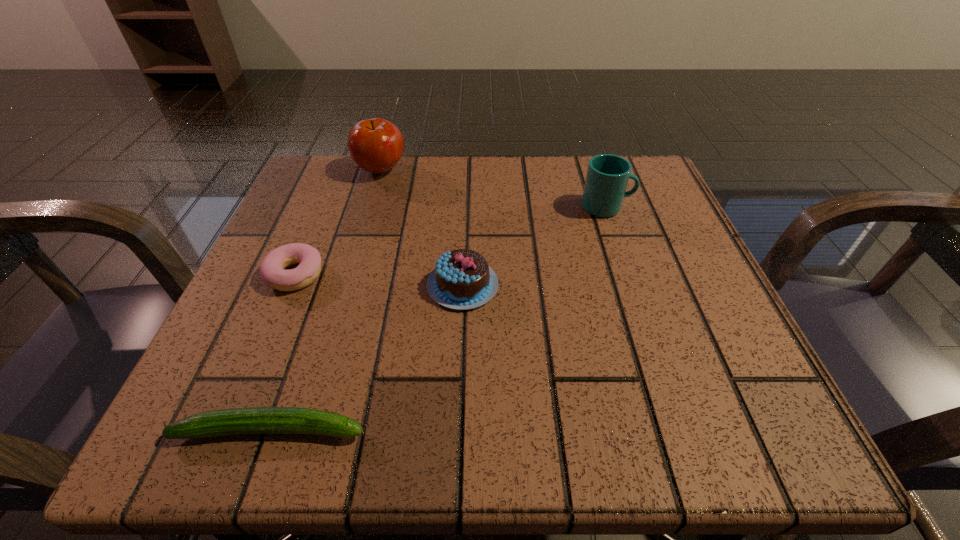
Where is `free point between the second shortest object and the nearest object`? free point between the second shortest object and the nearest object is located at coordinates (283, 352).

Locate an element on the screen. This screenshot has width=960, height=540. object that ranks as the fourth closest to the cup is located at coordinates (255, 420).

You are a GUI agent. You are given a task and a screenshot of the screen. Output one action in this format:
    pyautogui.click(x=<x>, y=<y>)
    Task: Click on the third closest object to the doughnut
    This screenshot has width=960, height=540.
    Given the screenshot: What is the action you would take?
    pyautogui.click(x=376, y=145)

What are the coordinates of `vacant position in the image that satisfies the following two spatial constraints: 1. on the front side of the doughnut; 2. on the right side of the third tallest object` in the screenshot? It's located at (291, 285).

This screenshot has height=540, width=960. I want to click on vacant space that satisfies the following two spatial constraints: 1. on the handle side of the cup; 2. on the front side of the doughnut, so click(x=630, y=275).